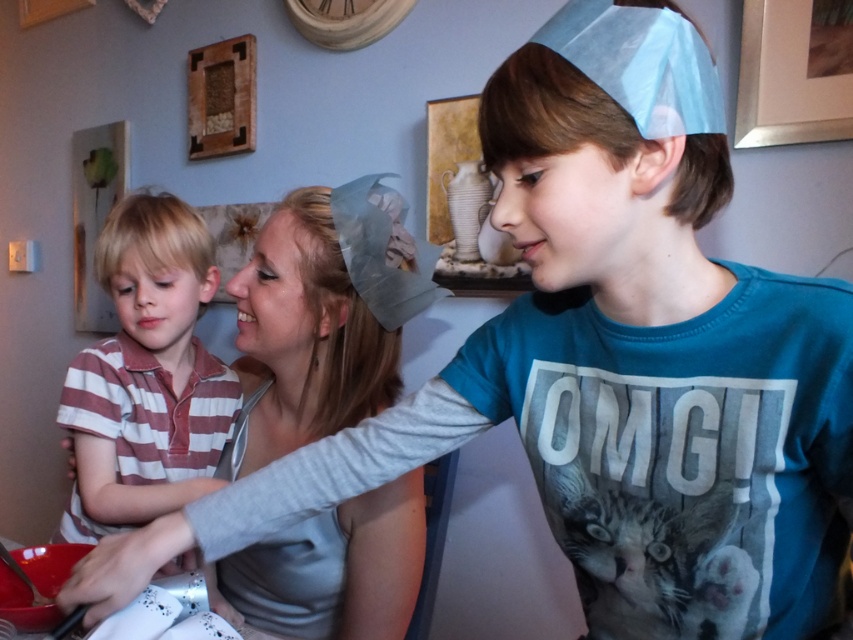
Question: From the image, what is the correct spatial relationship of gray fabric headband at upper center in relation to striped cotton shirt at left?

Choices:
 (A) above
 (B) below

Answer: (B)

Question: Which of the following is the closest to the observer?

Choices:
 (A) striped cotton shirt at left
 (B) gray fabric headband at upper center

Answer: (B)

Question: Can you confirm if gray fabric headband at upper center is smaller than striped cotton shirt at left?

Choices:
 (A) yes
 (B) no

Answer: (A)

Question: Does gray fabric headband at upper center appear over striped cotton shirt at left?

Choices:
 (A) no
 (B) yes

Answer: (A)

Question: Which object is closer to the camera taking this photo?

Choices:
 (A) striped cotton shirt at left
 (B) gray fabric headband at upper center

Answer: (B)